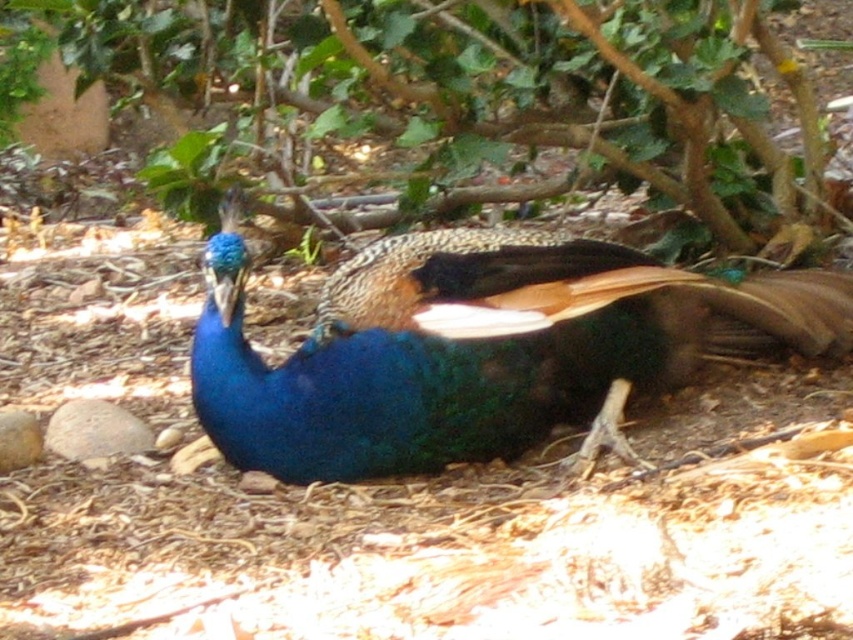
Is green leafy tree at upper center taller than shiny blue peacock at center?

Yes.

This screenshot has height=640, width=853. What do you see at coordinates (445, 104) in the screenshot?
I see `green leafy tree at upper center` at bounding box center [445, 104].

Locate an element on the screen. green leafy tree at upper center is located at coordinates (445, 104).